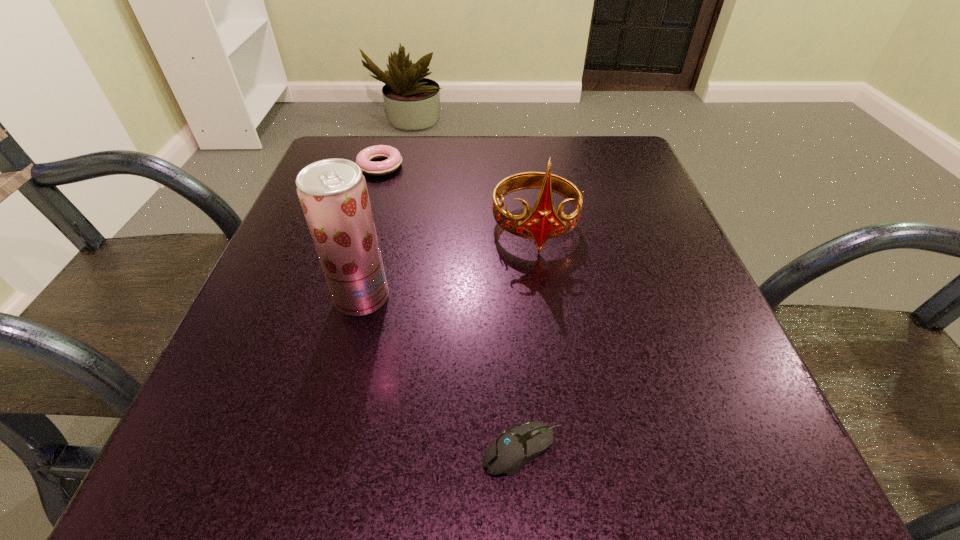
Locate which object ranks in proximity to the second nearest object. Please provide its 2D coordinates. Your answer should be formatted as a tuple, i.e. [(x, y)], where the tuple contains the x and y coordinates of a point satisfying the conditions above.

[(542, 223)]

Identify the location of blank space that satisfies the following two spatial constraints: 1. on the front side of the nearest object; 2. on the left side of the fruit juice. This screenshot has width=960, height=540. (323, 450).

This screenshot has width=960, height=540. Find the location of `vacant space that satisfies the following two spatial constraints: 1. on the front side of the nearest object; 2. on the right side of the third farthest object`. vacant space that satisfies the following two spatial constraints: 1. on the front side of the nearest object; 2. on the right side of the third farthest object is located at coordinates (323, 450).

Find the location of a particular element. The width and height of the screenshot is (960, 540). free space that satisfies the following two spatial constraints: 1. on the front side of the fruit juice; 2. on the left side of the farthest object is located at coordinates (341, 298).